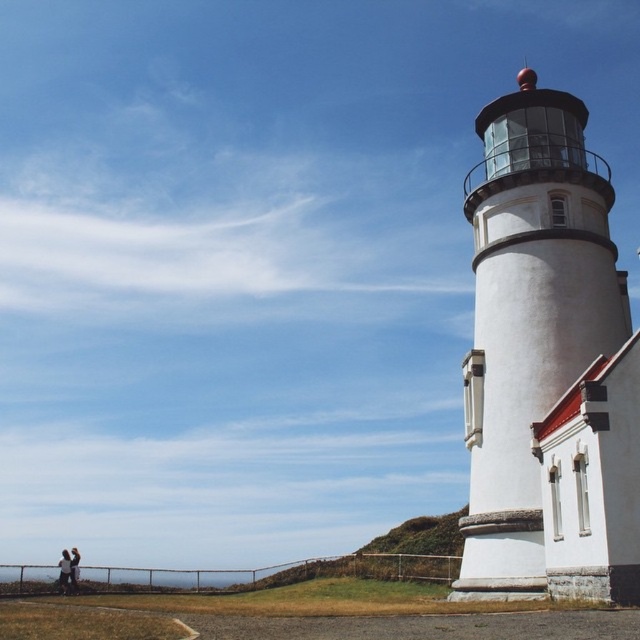
Is white cotton shirt at lower left further to camera compared to light brown leather jacket at lower left?

No, white cotton shirt at lower left is closer to the viewer.

From the picture: Can you confirm if white cotton shirt at lower left is taller than light brown leather jacket at lower left?

Correct, white cotton shirt at lower left is much taller as light brown leather jacket at lower left.

Between point (61, 566) and point (72, 557), which one is positioned in front?

Positioned in front is point (61, 566).

Identify the location of white cotton shirt at lower left. The image size is (640, 640). (64, 572).

Who is lower down, white painted stone tower at right or light brown leather jacket at lower left?

Positioned lower is light brown leather jacket at lower left.

Consider the image. Which is more to the right, white painted stone tower at right or light brown leather jacket at lower left?

white painted stone tower at right

Who is more distant from viewer, (467, 195) or (72, 570)?

Point (72, 570)

Locate an element on the screen. This screenshot has height=640, width=640. white painted stone tower at right is located at coordinates (547, 364).

Is white painted stone tower at right smaller than white cotton shirt at lower left?

Yes, white painted stone tower at right is smaller than white cotton shirt at lower left.

Locate an element on the screen. This screenshot has width=640, height=640. white painted stone tower at right is located at coordinates (547, 364).